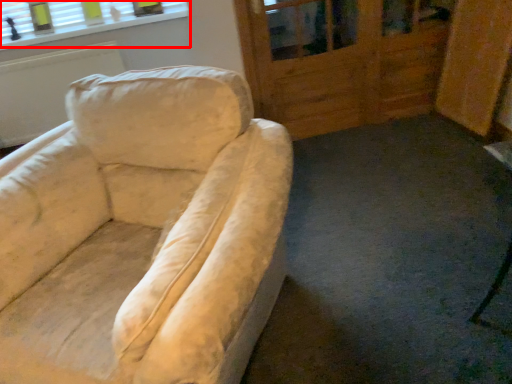
Question: From the image's perspective, where is window (annotated by the red box) located relative to screen door?

Choices:
 (A) above
 (B) below

Answer: (A)